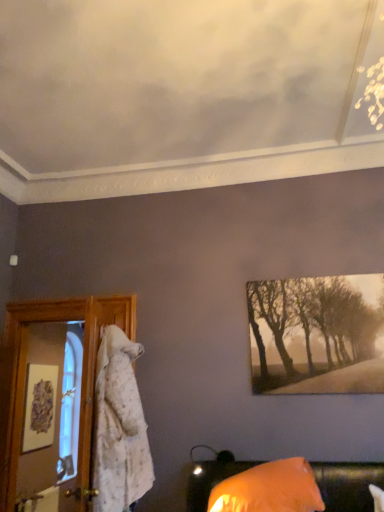
Question: From a real-world perspective, does matte white picture frame at left sit lower than orange fabric pillow at lower right?

Choices:
 (A) yes
 (B) no

Answer: (B)

Question: Could you tell me if matte white picture frame at left is facing orange fabric pillow at lower right?

Choices:
 (A) yes
 (B) no

Answer: (B)

Question: Can you confirm if matte white picture frame at left is shorter than orange fabric pillow at lower right?

Choices:
 (A) yes
 (B) no

Answer: (B)

Question: Can you confirm if matte white picture frame at left is thinner than orange fabric pillow at lower right?

Choices:
 (A) yes
 (B) no

Answer: (A)

Question: Would you say orange fabric pillow at lower right is part of matte white picture frame at left's contents?

Choices:
 (A) no
 (B) yes

Answer: (A)

Question: Looking at the image, does sepia-toned canvas at upper right seem bigger or smaller compared to matte white picture frame at left?

Choices:
 (A) small
 (B) big

Answer: (B)

Question: Is sepia-toned canvas at upper right situated inside matte white picture frame at left or outside?

Choices:
 (A) outside
 (B) inside

Answer: (A)

Question: Considering the positions of sepia-toned canvas at upper right and matte white picture frame at left in the image, is sepia-toned canvas at upper right taller or shorter than matte white picture frame at left?

Choices:
 (A) tall
 (B) short

Answer: (A)

Question: From a real-world perspective, is sepia-toned canvas at upper right above or below matte white picture frame at left?

Choices:
 (A) below
 (B) above

Answer: (B)

Question: Considering their positions, is orange fabric pillow at lower right located in front of or behind sepia-toned canvas at upper right?

Choices:
 (A) front
 (B) behind

Answer: (A)

Question: Is orange fabric pillow at lower right situated inside sepia-toned canvas at upper right or outside?

Choices:
 (A) outside
 (B) inside

Answer: (A)

Question: Considering the positions of orange fabric pillow at lower right and sepia-toned canvas at upper right in the image, is orange fabric pillow at lower right taller or shorter than sepia-toned canvas at upper right?

Choices:
 (A) short
 (B) tall

Answer: (A)

Question: Is orange fabric pillow at lower right bigger or smaller than sepia-toned canvas at upper right?

Choices:
 (A) big
 (B) small

Answer: (A)

Question: In terms of size, does matte white picture frame at left appear bigger or smaller than sepia-toned canvas at upper right?

Choices:
 (A) small
 (B) big

Answer: (A)

Question: In the image, is matte white picture frame at left on the left side or the right side of sepia-toned canvas at upper right?

Choices:
 (A) right
 (B) left

Answer: (B)